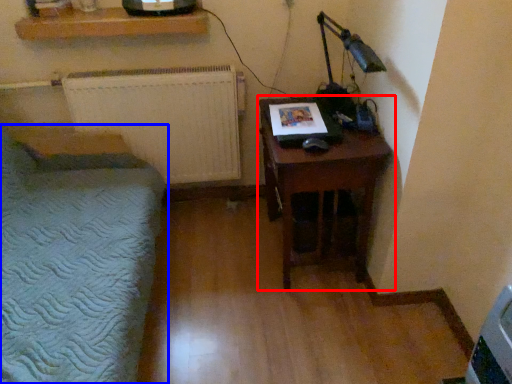
Question: Which of the following is the closest to the observer, nightstand (highlighted by a red box) or furniture (highlighted by a blue box)?

Choices:
 (A) nightstand
 (B) furniture

Answer: (B)